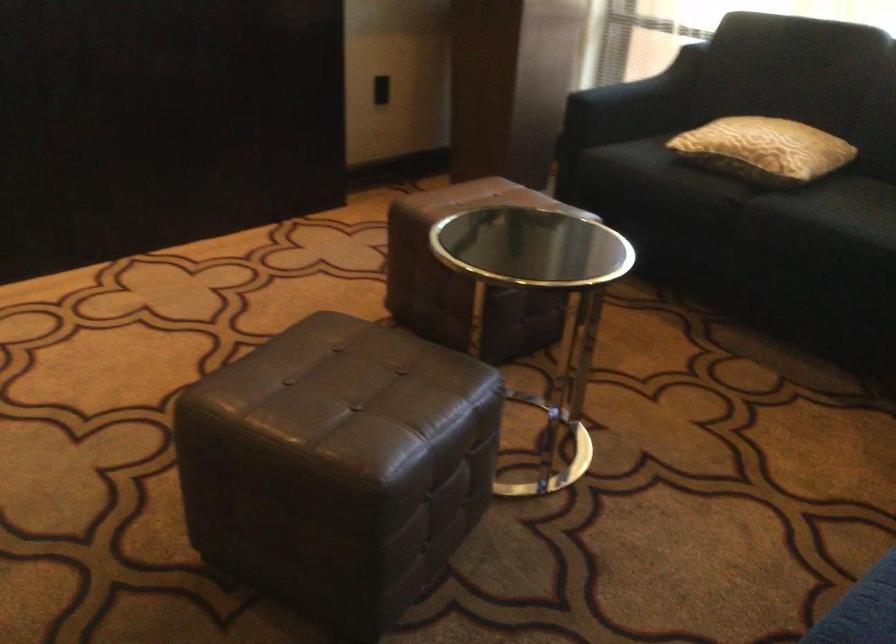
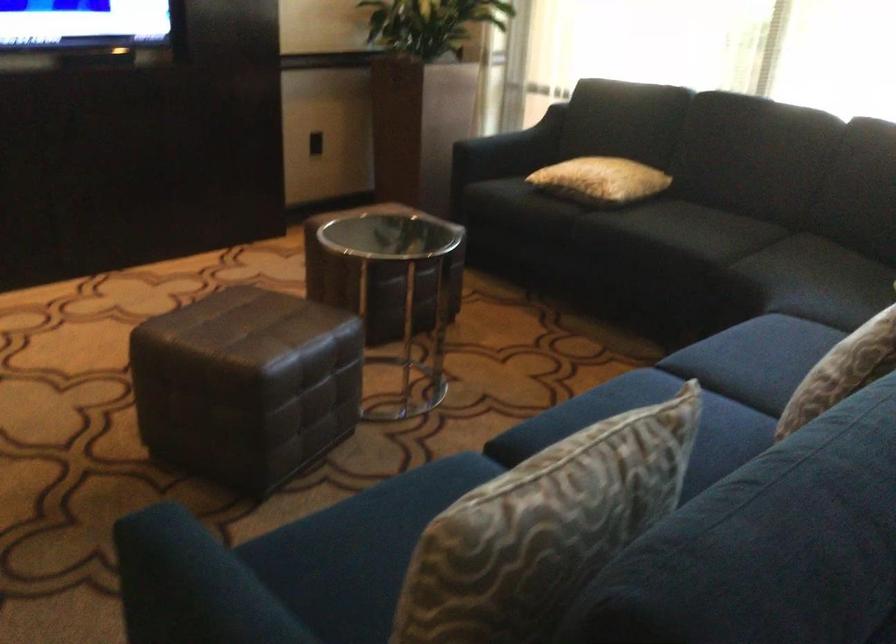
What movement of the cameraman would produce the second image?

The cameraman moved toward right, backward.